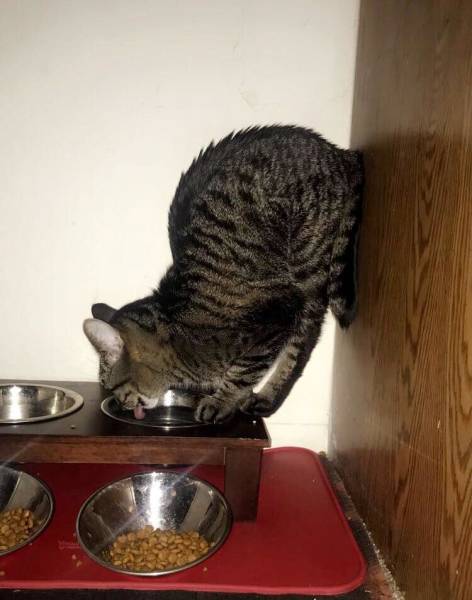
This screenshot has width=472, height=600. What are the coordinates of `metal bowl` in the screenshot? It's located at (145, 506), (29, 486), (41, 399), (144, 422).